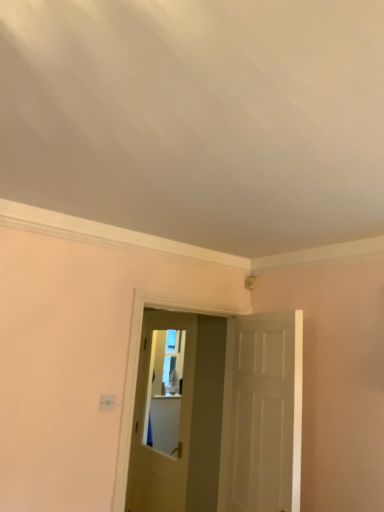
Question: Can you confirm if white plastic light switch at lower left is taller than white matte door at center, which is the 1th door in right-to-left order?

Choices:
 (A) no
 (B) yes

Answer: (A)

Question: Is white matte door at center, which is the 1th door from front to back, a part of white plastic light switch at lower left?

Choices:
 (A) yes
 (B) no

Answer: (B)

Question: Is there a large distance between white plastic light switch at lower left and white matte door at center, which is the second door in left-to-right order?

Choices:
 (A) no
 (B) yes

Answer: (A)

Question: From the image's perspective, is white plastic light switch at lower left over white matte door at center, which is the second door in left-to-right order?

Choices:
 (A) yes
 (B) no

Answer: (A)

Question: Does white plastic light switch at lower left lie behind white matte door at center, which is the second door in left-to-right order?

Choices:
 (A) yes
 (B) no

Answer: (A)

Question: Can you confirm if white plastic light switch at lower left is wider than white matte door at center, which is the second door in left-to-right order?

Choices:
 (A) no
 (B) yes

Answer: (A)

Question: Is white matte door at center, which is the 1th door from front to back, behind white plastic light switch at lower left?

Choices:
 (A) yes
 (B) no

Answer: (B)

Question: Can you see white matte door at center, which is the 1th door in right-to-left order, touching white plastic light switch at lower left?

Choices:
 (A) yes
 (B) no

Answer: (B)

Question: Are white matte door at center, which is counted as the 2th door, starting from the back, and white plastic light switch at lower left far apart?

Choices:
 (A) no
 (B) yes

Answer: (A)

Question: Considering the relative sizes of white matte door at center, which is the 1th door in right-to-left order, and white plastic light switch at lower left in the image provided, is white matte door at center, which is the 1th door in right-to-left order, wider than white plastic light switch at lower left?

Choices:
 (A) yes
 (B) no

Answer: (A)

Question: Considering the relative sizes of white matte door at center, which is the 1th door from front to back, and white plastic light switch at lower left in the image provided, is white matte door at center, which is the 1th door from front to back, thinner than white plastic light switch at lower left?

Choices:
 (A) no
 (B) yes

Answer: (A)

Question: Would you say white matte door at center, which is the 1th door in right-to-left order, contains white plastic light switch at lower left?

Choices:
 (A) yes
 (B) no

Answer: (B)

Question: Is matte white door at center, the first door when ordered from left to right, at the left side of white plastic light switch at lower left?

Choices:
 (A) no
 (B) yes

Answer: (A)